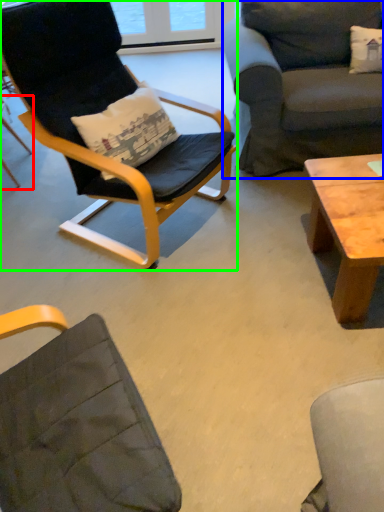
Question: Based on their relative distances, which object is nearer to chair (highlighted by a red box)? Choose from studio couch (highlighted by a blue box) and chair (highlighted by a green box).

Choices:
 (A) studio couch
 (B) chair

Answer: (B)